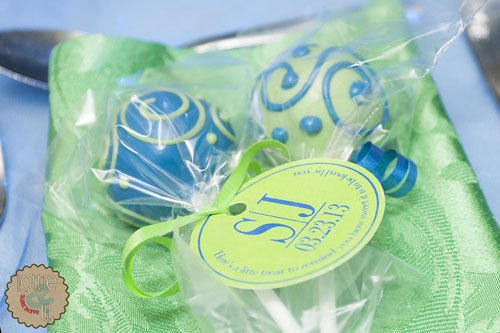
Identify the location of spoon. This screenshot has height=333, width=500. (35, 59).